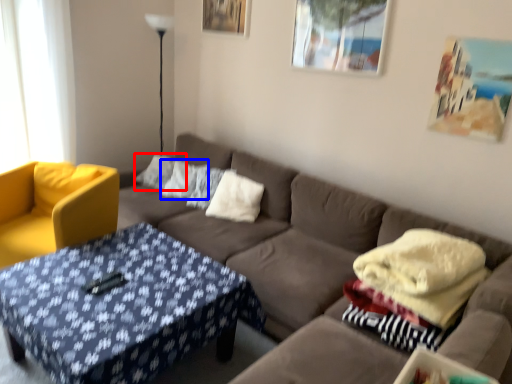
Question: Among these objects, which one is farthest to the camera, pillow (highlighted by a red box) or pillow (highlighted by a blue box)?

Choices:
 (A) pillow
 (B) pillow

Answer: (A)